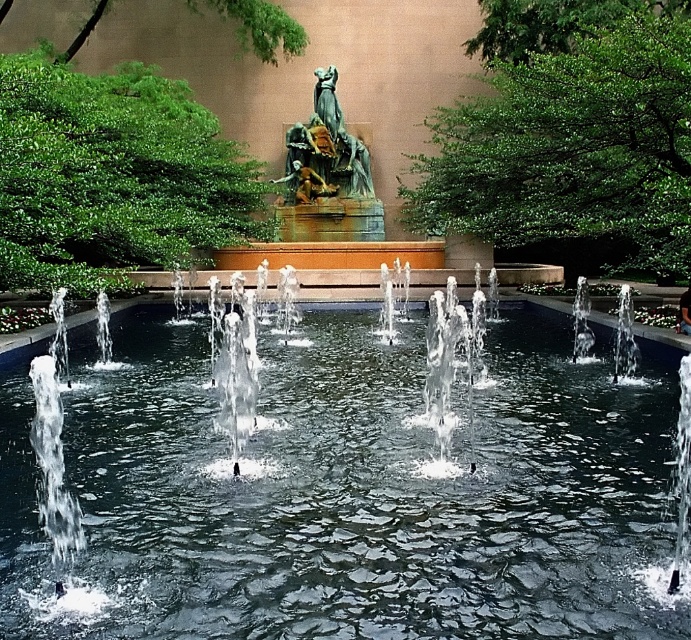
Question: Which object is closer to the camera taking this photo?

Choices:
 (A) bronze statue at center
 (B) clear water at center

Answer: (B)

Question: Does clear water at center appear under bronze statue at center?

Choices:
 (A) yes
 (B) no

Answer: (A)

Question: Is clear water at center smaller than bronze statue at center?

Choices:
 (A) no
 (B) yes

Answer: (A)

Question: From the image, what is the correct spatial relationship of clear water at center in relation to bronze statue at center?

Choices:
 (A) below
 (B) above

Answer: (A)

Question: Among these points, which one is farthest from the camera?

Choices:
 (A) (370, 182)
 (B) (191, 522)

Answer: (A)

Question: Which object appears closest to the camera in this image?

Choices:
 (A) bronze statue at center
 (B) clear water at center

Answer: (B)